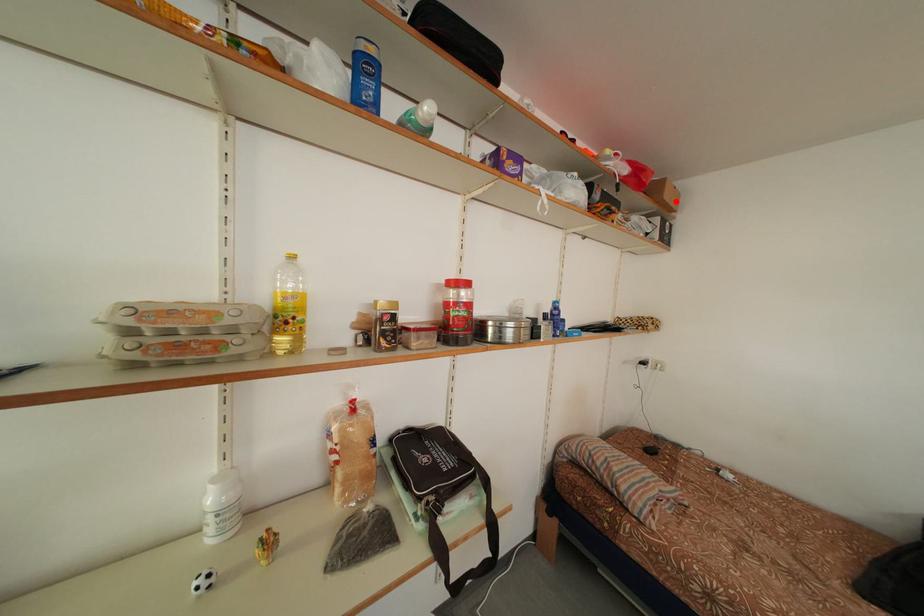
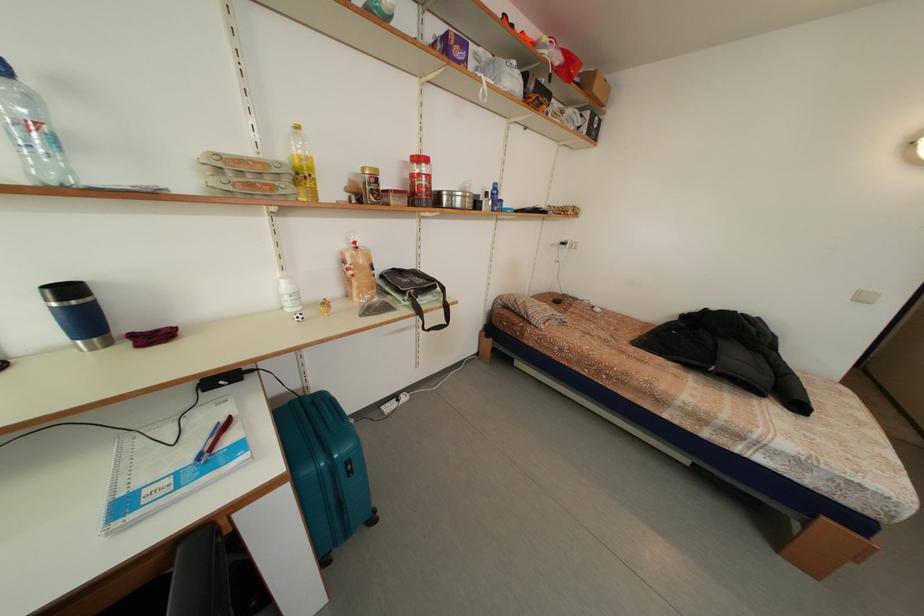
Find the pixel in the second image that matches the highlighted location in the first image.

(603, 95)